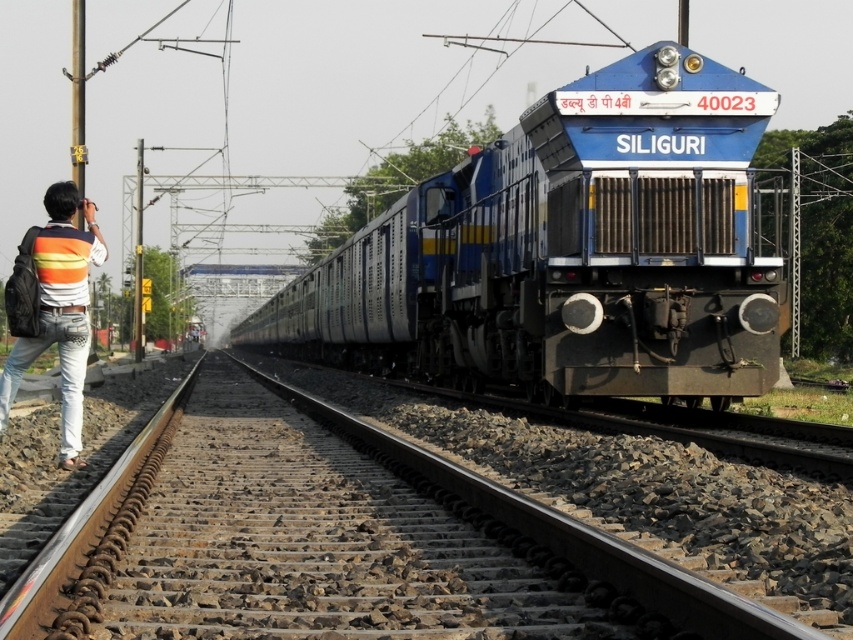
Between blue metallic train at center and brown gravel train track at center, which one has less height?

With less height is brown gravel train track at center.

Does blue metallic train at center have a greater width compared to brown gravel train track at center?

Yes.

Between point (578, 125) and point (143, 444), which one is positioned behind?

The point (578, 125) is more distant.

Find the location of a particular element. blue metallic train at center is located at coordinates (567, 252).

The image size is (853, 640). I want to click on blue metallic train at center, so click(x=567, y=252).

Does point (718, 192) come behind point (90, 205)?

Yes.

Describe the element at coordinates (567, 252) in the screenshot. The width and height of the screenshot is (853, 640). I see `blue metallic train at center` at that location.

Locate an element on the screen. This screenshot has width=853, height=640. blue metallic train at center is located at coordinates (567, 252).

Between brown gravel train track at center and striped sweater at left, which one appears on the left side from the viewer's perspective?

From the viewer's perspective, striped sweater at left appears more on the left side.

Locate an element on the screen. This screenshot has width=853, height=640. brown gravel train track at center is located at coordinates (337, 541).